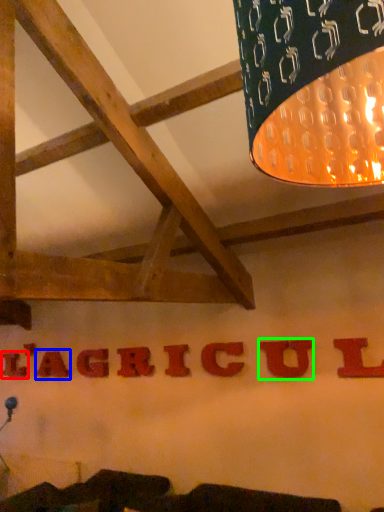
Question: Based on their relative distances, which object is farther from letter (highlighted by a red box)? Choose from letter (highlighted by a blue box) and letter (highlighted by a green box).

Choices:
 (A) letter
 (B) letter

Answer: (B)